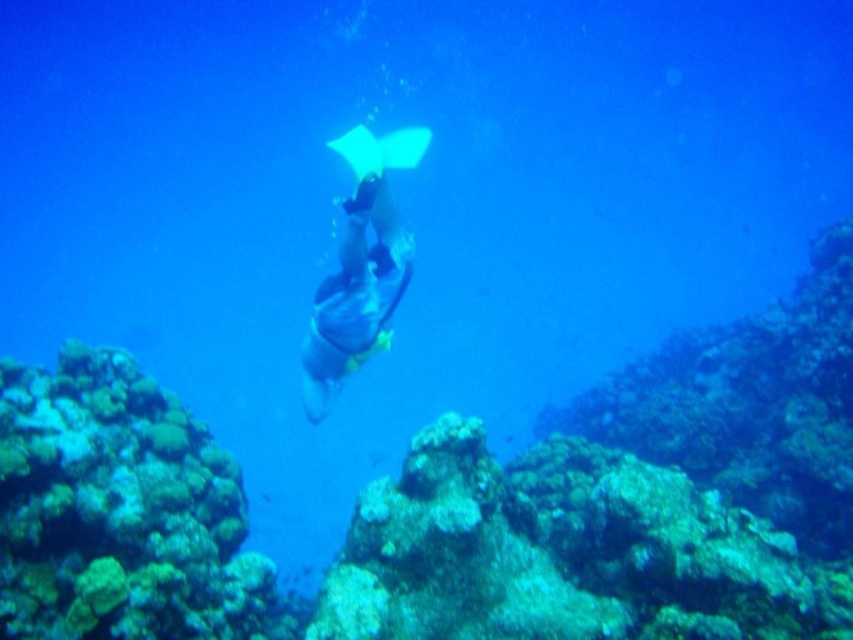
Question: Which point appears farthest from the camera in this image?

Choices:
 (A) (314, 410)
 (B) (604, 456)
 (C) (398, 164)

Answer: (B)

Question: Which object is positioned closest to the translucent white stingray at center?

Choices:
 (A) blue rubber glove at center
 (B) rough textured coral reef at center

Answer: (A)

Question: From the image, what is the correct spatial relationship of rough textured coral reef at center in relation to translucent white stingray at center?

Choices:
 (A) left
 (B) right

Answer: (B)

Question: Is blue rubber glove at center positioned in front of translucent white stingray at center?

Choices:
 (A) yes
 (B) no

Answer: (B)

Question: Is rough textured coral reef at center below translucent white stingray at center?

Choices:
 (A) yes
 (B) no

Answer: (A)

Question: Which object appears farthest from the camera in this image?

Choices:
 (A) blue rubber glove at center
 (B) translucent white stingray at center

Answer: (A)